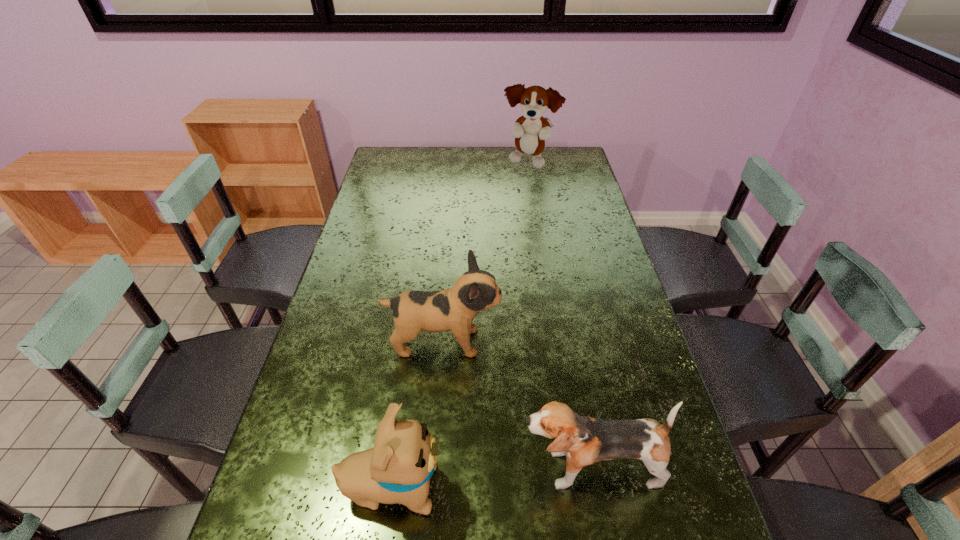
At what (x,y) coordinates should I click in order to perform the action: click on vacant space at the far right corner of the desktop. Please return your answer as a coordinate pair (x, y). Looking at the image, I should click on (550, 165).

The height and width of the screenshot is (540, 960). I want to click on unoccupied position between the farthest object and the third nearest object, so click(486, 253).

This screenshot has height=540, width=960. I want to click on object that is the closest to the second farthest puppy, so click(583, 440).

Locate an element on the screen. This screenshot has height=540, width=960. object that is the second closest to the second farthest puppy is located at coordinates (398, 468).

Locate an element on the screen. This screenshot has width=960, height=540. puppy that is the third closest to the third nearest puppy is located at coordinates (530, 131).

Point out which puppy is positioned as the second nearest to the third nearest object. Please provide its 2D coordinates. Your answer should be formatted as a tuple, i.e. [(x, y)], where the tuple contains the x and y coordinates of a point satisfying the conditions above.

[(398, 468)]

In order to click on free space in the image that satisfies the following two spatial constraints: 1. on the face of the farthest object; 2. at the face of the second farthest object in this screenshot , I will do `click(558, 342)`.